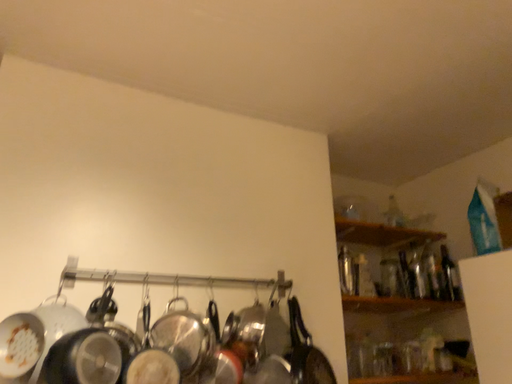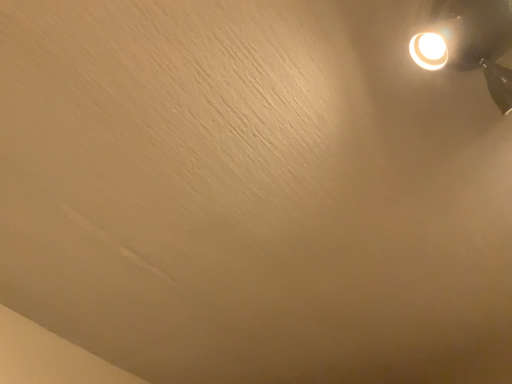
Question: Which way did the camera rotate in the video?

Choices:
 (A) rotated downward
 (B) rotated upward

Answer: (B)